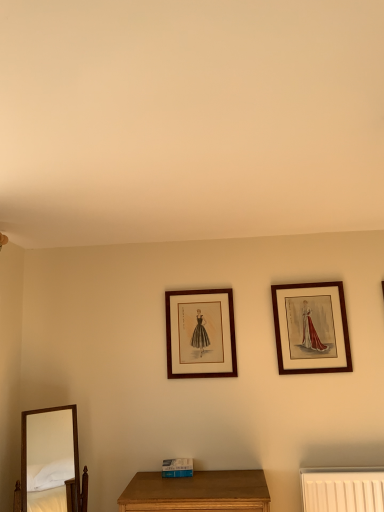
Question: Is matte wood picture frame at center, marked as the first picture frame in a left-to-right arrangement, taller or shorter than wooden framed print at upper right, arranged as the 1th picture frame when viewed from the right?

Choices:
 (A) tall
 (B) short

Answer: (B)

Question: In terms of size, does matte wood picture frame at center, acting as the second picture frame starting from the right, appear bigger or smaller than wooden framed print at upper right, the 2th picture frame viewed from the left?

Choices:
 (A) small
 (B) big

Answer: (A)

Question: Considering the real-world distances, which object is closest to the matte wood picture frame at center, marked as the first picture frame in a left-to-right arrangement?

Choices:
 (A) wooden mirror at lower left
 (B) wooden framed print at upper right, arranged as the 1th picture frame when viewed from the right

Answer: (B)

Question: Which is farther from the wooden mirror at lower left?

Choices:
 (A) matte wood picture frame at center, acting as the second picture frame starting from the right
 (B) wooden framed print at upper right, the 2th picture frame viewed from the left

Answer: (B)